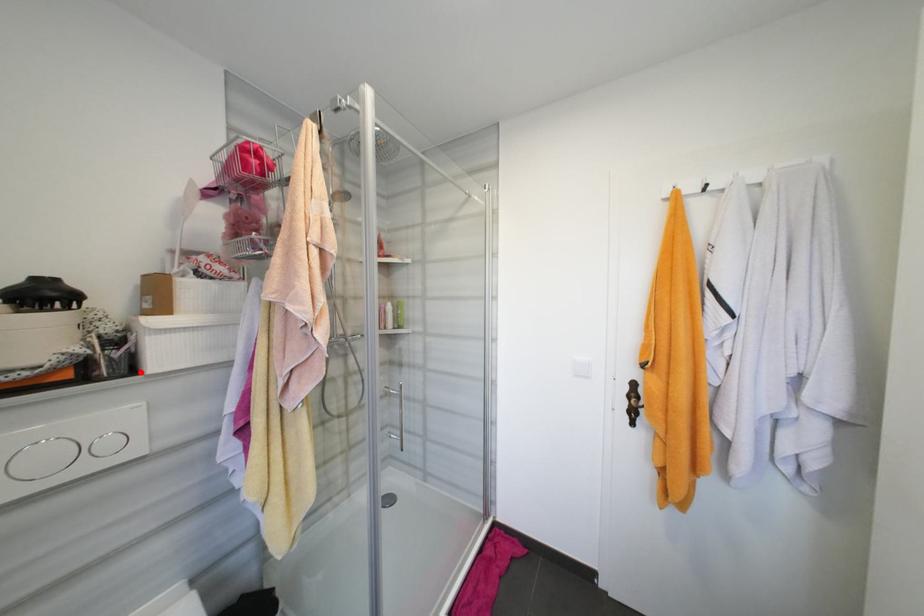
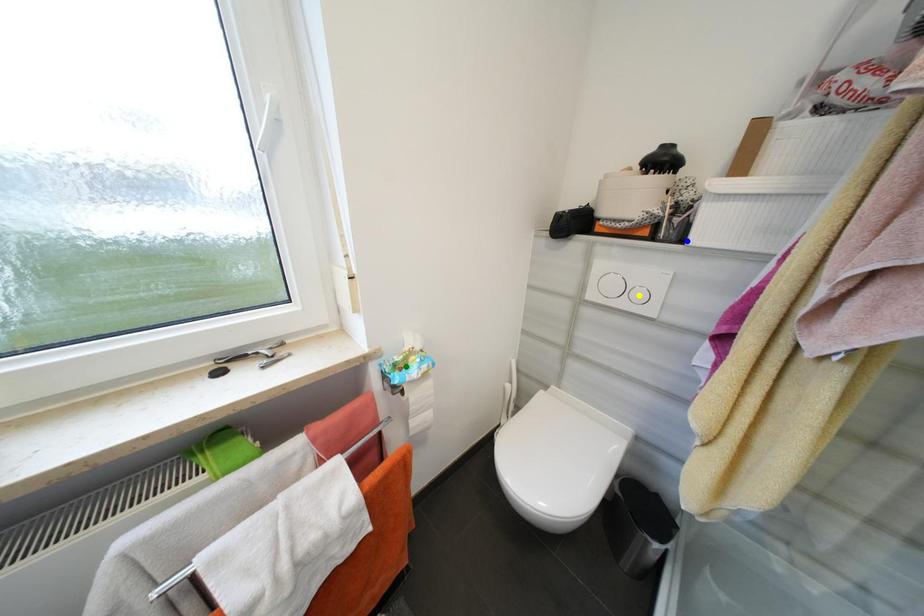
Question: I am providing you with two images of the same scene from different viewpoints. A red point is marked on the first image. You are given multiple points on the second image. Which point in image 2 represents the same 3d spot as the red point in image 1?

Choices:
 (A) blue point
 (B) yellow point
 (C) green point

Answer: (A)